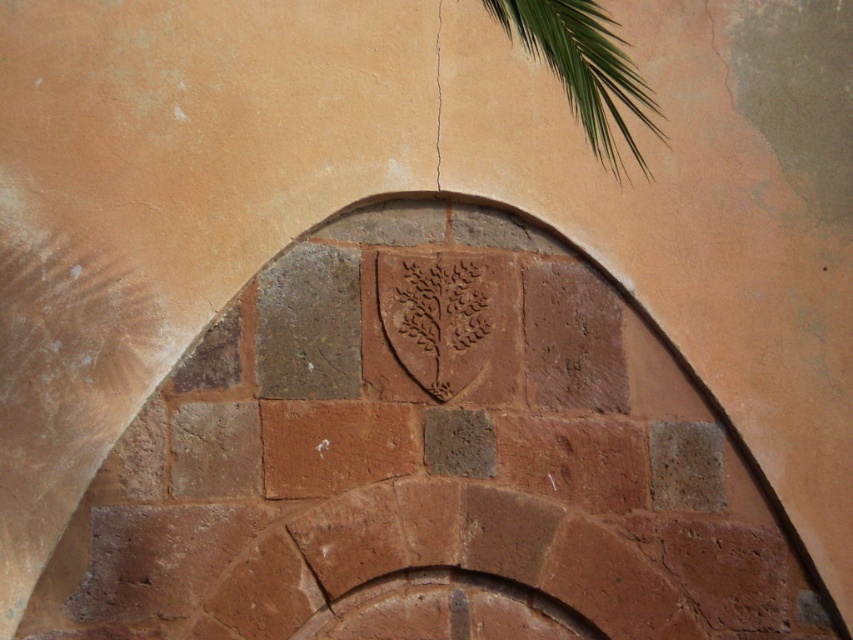
Question: Considering the relative positions of rustic stone archway at center and red stone brick at center in the image provided, where is rustic stone archway at center located with respect to red stone brick at center?

Choices:
 (A) below
 (B) above

Answer: (A)

Question: Which of the following is the farthest from the observer?

Choices:
 (A) red stone brick at center
 (B) rustic stone archway at center

Answer: (A)

Question: Does rustic stone archway at center have a larger size compared to red stone brick at center?

Choices:
 (A) yes
 (B) no

Answer: (A)

Question: Which of the following is the closest to the observer?

Choices:
 (A) (341, 445)
 (B) (590, 49)

Answer: (A)

Question: Is rustic stone archway at center further to camera compared to red stone brick at center?

Choices:
 (A) no
 (B) yes

Answer: (A)

Question: Which object appears farthest from the camera in this image?

Choices:
 (A) red stone brick at center
 (B) rustic stone archway at center

Answer: (A)